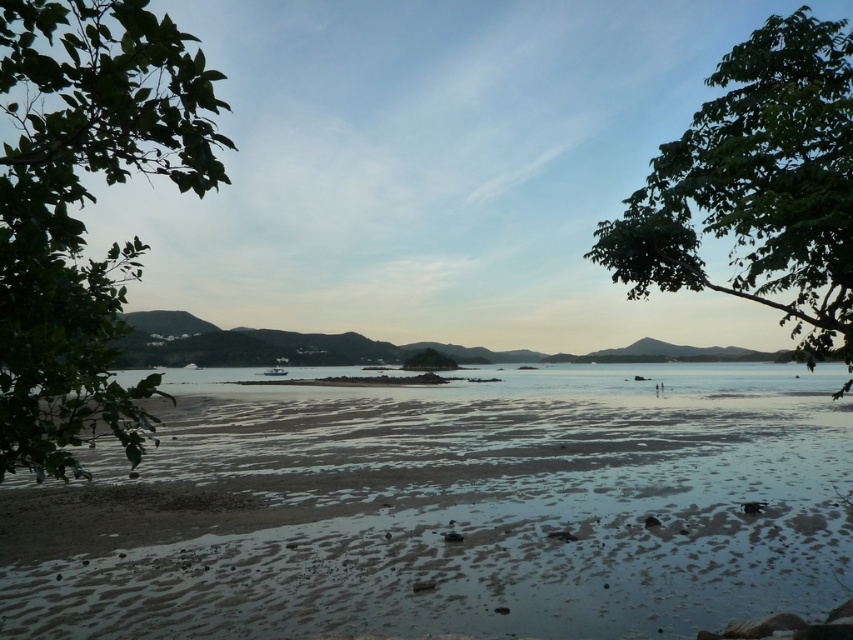
You are standing on the beach and want to take a photo of both the green leafy tree at upper right and the green matte island at center. Which object should you frame first in your camera to ensure both are in the shot?

You should frame the green leafy tree at upper right first because it is positioned on the right side of the green matte island at center, so by starting with the tree on the right, you can adjust the camera to include both objects in the frame.

You are planning to build a small cabin on the sandy beach at lower left and the green matte island at center. Which location would allow you to have more space for construction?

The sandy beach at lower left is larger in size than the green matte island at center, so it would provide more space for construction.